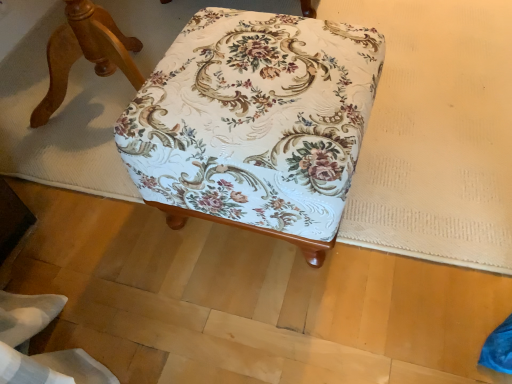
Question: Should I look upward or downward to see floral fabric ottoman at center, which is the 2th furniture in left-to-right order?

Choices:
 (A) down
 (B) up

Answer: (B)

Question: Is floral fabric ottoman at center, arranged as the first furniture when viewed from the right, taller than floral fabric ottoman at center, the second furniture in the right-to-left sequence?

Choices:
 (A) yes
 (B) no

Answer: (B)

Question: Would you say floral fabric ottoman at center, arranged as the first furniture when viewed from the right, is outside floral fabric ottoman at center, which is counted as the first furniture, starting from the left?

Choices:
 (A) yes
 (B) no

Answer: (A)

Question: Does floral fabric ottoman at center, arranged as the first furniture when viewed from the right, appear on the left side of floral fabric ottoman at center, the second furniture in the right-to-left sequence?

Choices:
 (A) no
 (B) yes

Answer: (A)

Question: Does floral fabric ottoman at center, which is the 2th furniture in left-to-right order, lie in front of floral fabric ottoman at center, the second furniture in the right-to-left sequence?

Choices:
 (A) no
 (B) yes

Answer: (B)

Question: From a real-world perspective, is floral fabric ottoman at center, arranged as the first furniture when viewed from the right, positioned under floral fabric ottoman at center, the second furniture in the right-to-left sequence, based on gravity?

Choices:
 (A) no
 (B) yes

Answer: (B)

Question: Does floral fabric ottoman at center, which is the 2th furniture in left-to-right order, have a lesser width compared to floral fabric ottoman at center, which is counted as the first furniture, starting from the left?

Choices:
 (A) no
 (B) yes

Answer: (B)

Question: From the image's perspective, does floral fabric ottoman at center, the second furniture in the right-to-left sequence, appear lower than floral fabric ottoman at center, arranged as the first furniture when viewed from the right?

Choices:
 (A) no
 (B) yes

Answer: (A)

Question: Is floral fabric ottoman at center, the second furniture in the right-to-left sequence, beside floral fabric ottoman at center, arranged as the first furniture when viewed from the right?

Choices:
 (A) yes
 (B) no

Answer: (B)

Question: Does floral fabric ottoman at center, which is counted as the first furniture, starting from the left, come in front of floral fabric ottoman at center, arranged as the first furniture when viewed from the right?

Choices:
 (A) yes
 (B) no

Answer: (B)

Question: Is floral fabric ottoman at center, arranged as the first furniture when viewed from the right, at the back of floral fabric ottoman at center, the second furniture in the right-to-left sequence?

Choices:
 (A) no
 (B) yes

Answer: (A)

Question: Would you consider floral fabric ottoman at center, which is counted as the first furniture, starting from the left, to be distant from floral fabric ottoman at center, which is the 2th furniture in left-to-right order?

Choices:
 (A) no
 (B) yes

Answer: (A)

Question: Can you confirm if floral fabric ottoman at center, the second furniture in the right-to-left sequence, is smaller than floral fabric ottoman at center, which is the 2th furniture in left-to-right order?

Choices:
 (A) no
 (B) yes

Answer: (A)

Question: Considering the relative positions of floral fabric ottoman at center, which is the 2th furniture in left-to-right order, and floral fabric ottoman at center, which is counted as the first furniture, starting from the left, in the image provided, is floral fabric ottoman at center, which is the 2th furniture in left-to-right order, to the left or to the right of floral fabric ottoman at center, which is counted as the first furniture, starting from the left,?

Choices:
 (A) right
 (B) left

Answer: (A)